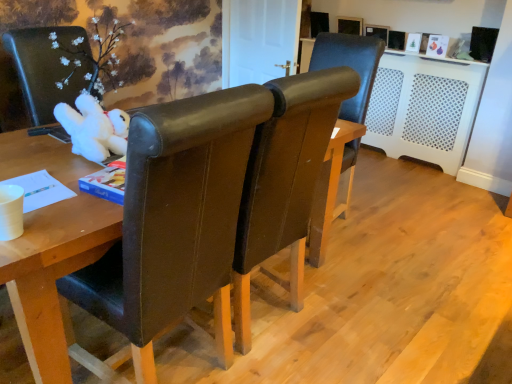
Question: Are brown leather chair at center, acting as the first chair starting from the front, and brown leather chair at center, positioned as the first chair in back-to-front order, far apart?

Choices:
 (A) yes
 (B) no

Answer: (A)

Question: From a real-world perspective, is brown leather chair at center, the 3th chair positioned from the back, beneath brown leather chair at center, positioned as the first chair in back-to-front order?

Choices:
 (A) no
 (B) yes

Answer: (A)

Question: Is brown leather chair at center, acting as the first chair starting from the front, thinner than brown leather chair at center, the third chair positioned from the front?

Choices:
 (A) no
 (B) yes

Answer: (A)

Question: Is brown leather chair at center, acting as the first chair starting from the front, directly adjacent to brown leather chair at center, the third chair positioned from the front?

Choices:
 (A) yes
 (B) no

Answer: (B)

Question: Would you say brown leather chair at center, positioned as the first chair in back-to-front order, is part of brown leather chair at center, the 3th chair positioned from the back,'s contents?

Choices:
 (A) yes
 (B) no

Answer: (B)

Question: Considering the positions of brown leather chair at center, the 3th chair positioned from the back, and brown leather chair at center, which is counted as the second chair, starting from the back, in the image, is brown leather chair at center, the 3th chair positioned from the back, taller or shorter than brown leather chair at center, which is counted as the second chair, starting from the back,?

Choices:
 (A) short
 (B) tall

Answer: (B)

Question: Visually, is brown leather chair at center, the 3th chair positioned from the back, positioned to the left or to the right of brown leather chair at center, which is counted as the 2th chair, starting from the front?

Choices:
 (A) left
 (B) right

Answer: (A)

Question: Is brown leather chair at center, acting as the first chair starting from the front, wider or thinner than brown leather chair at center, which is counted as the second chair, starting from the back?

Choices:
 (A) wide
 (B) thin

Answer: (A)

Question: Considering the positions of brown leather chair at center, acting as the first chair starting from the front, and brown leather chair at center, which is counted as the 2th chair, starting from the front, in the image, is brown leather chair at center, acting as the first chair starting from the front, bigger or smaller than brown leather chair at center, which is counted as the 2th chair, starting from the front,?

Choices:
 (A) big
 (B) small

Answer: (B)

Question: From a real-world perspective, is white perforated plastic radiator at right above or below brown leather chair at center, which is counted as the second chair, starting from the back?

Choices:
 (A) below
 (B) above

Answer: (A)

Question: Is white perforated plastic radiator at right taller or shorter than brown leather chair at center, which is counted as the second chair, starting from the back?

Choices:
 (A) short
 (B) tall

Answer: (A)

Question: Is white perforated plastic radiator at right in front of or behind brown leather chair at center, which is counted as the second chair, starting from the back, in the image?

Choices:
 (A) behind
 (B) front

Answer: (A)

Question: Is white perforated plastic radiator at right inside or outside of brown leather chair at center, which is counted as the 2th chair, starting from the front?

Choices:
 (A) outside
 (B) inside

Answer: (A)

Question: From the image's perspective, is white plush toy at left above or below brown leather chair at center, which is counted as the second chair, starting from the back?

Choices:
 (A) below
 (B) above

Answer: (B)

Question: From their relative heights in the image, would you say white plush toy at left is taller or shorter than brown leather chair at center, which is counted as the 2th chair, starting from the front?

Choices:
 (A) tall
 (B) short

Answer: (B)